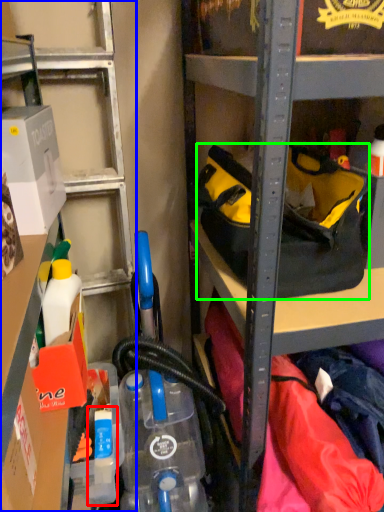
Question: Which object is the farthest from bottle (highlighted by a red box)? Choose among these: shelf (highlighted by a blue box) or handbag (highlighted by a green box).

Choices:
 (A) shelf
 (B) handbag

Answer: (A)